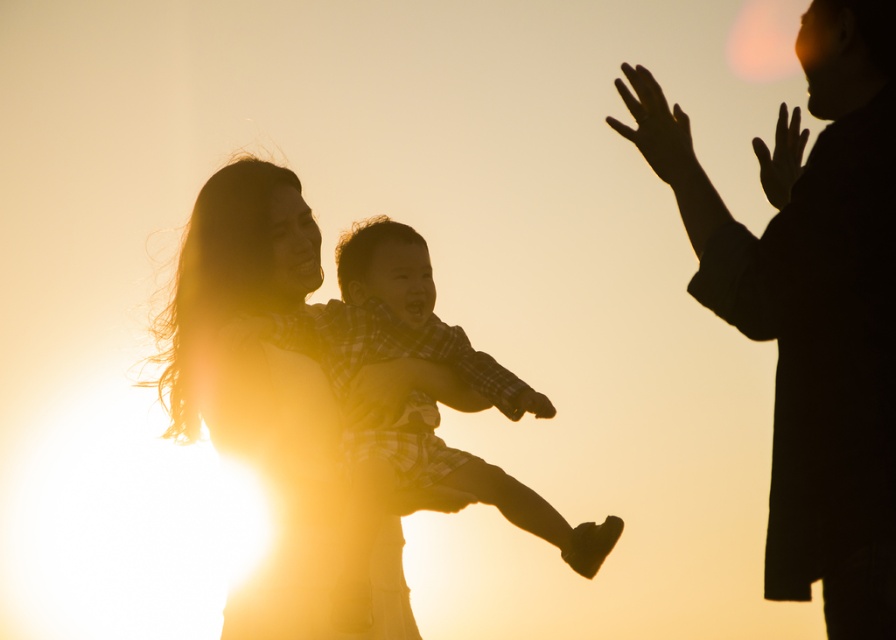
Question: Does silhouette dress at center appear over matte black hand at center?

Choices:
 (A) no
 (B) yes

Answer: (B)

Question: Is plaid fabric baby at center above black matte hand at upper right?

Choices:
 (A) yes
 (B) no

Answer: (B)

Question: Which of the following is the farthest from the observer?

Choices:
 (A) (823, 497)
 (B) (295, 355)

Answer: (B)

Question: Among these points, which one is nearest to the camera?

Choices:
 (A) (800, 253)
 (B) (464, 378)
 (C) (699, 166)

Answer: (A)

Question: Is plaid fabric baby at center thinner than silky smooth hand at upper right?

Choices:
 (A) no
 (B) yes

Answer: (A)

Question: Which of the following is the farthest from the observer?

Choices:
 (A) (313, 596)
 (B) (402, 484)
 (C) (636, 116)
 (D) (548, 401)

Answer: (D)